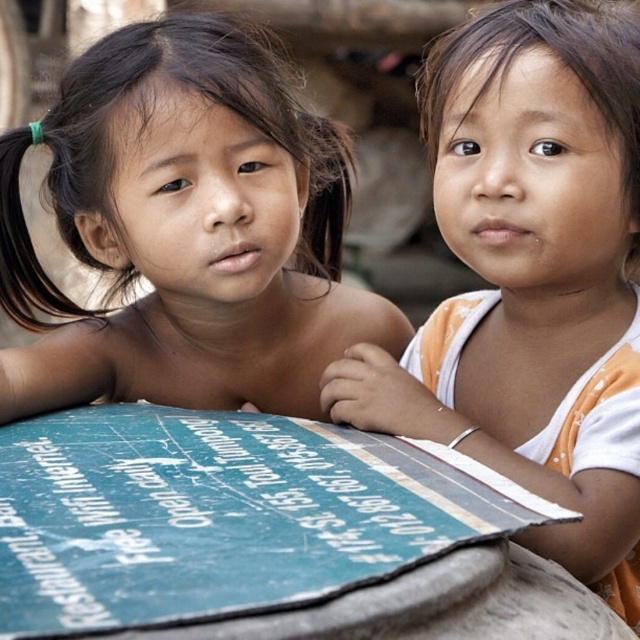
How distant is smooth skin child at center from matte orange tank top at center?

4.46 feet

Does smooth skin child at center have a greater height compared to matte orange tank top at center?

No, smooth skin child at center is not taller than matte orange tank top at center.

Find the location of `smooth skin child at center`. smooth skin child at center is located at coordinates [x=186, y=230].

Identify the location of smooth skin child at center. The height and width of the screenshot is (640, 640). (186, 230).